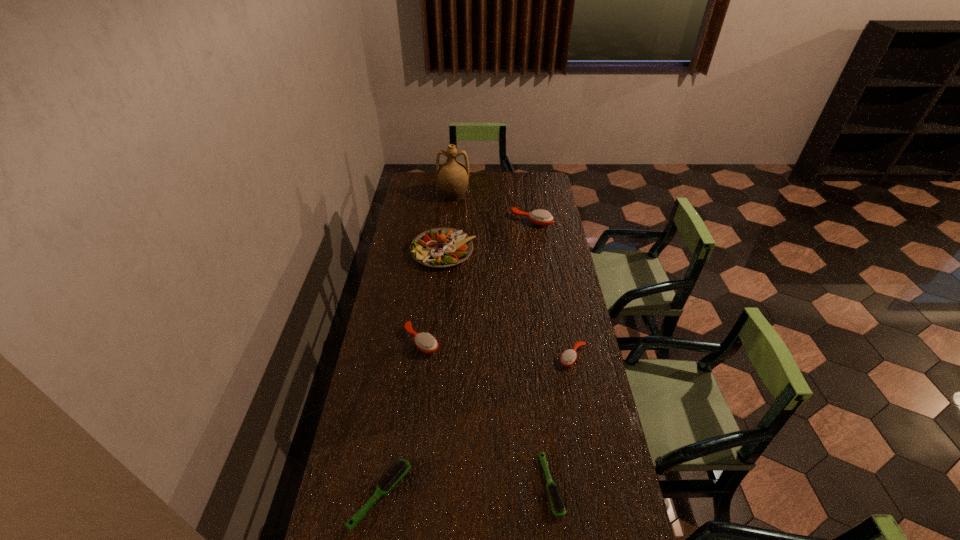
I want to click on the right light hairbrush, so click(x=557, y=504).

At what (x,y) coordinates should I click in order to perform the action: click on the shortest hairbrush. Please return your answer as a coordinate pair (x, y). This screenshot has width=960, height=540. Looking at the image, I should click on (557, 504).

Locate an element on the screen. The height and width of the screenshot is (540, 960). vacant space located on the front of the tallest object is located at coordinates [x=450, y=233].

Where is `vacant region located 0.180m on the front of the third farthest object`? vacant region located 0.180m on the front of the third farthest object is located at coordinates (439, 300).

Where is `free location located on the front of the farthest hairbrush`? free location located on the front of the farthest hairbrush is located at coordinates (540, 277).

Image resolution: width=960 pixels, height=540 pixels. In order to click on vacant region located on the front of the fourth tallest object in this screenshot , I will do `click(407, 458)`.

This screenshot has height=540, width=960. What are the coordinates of `free space located on the right of the left light hairbrush` in the screenshot? It's located at (512, 495).

Locate an element on the screen. This screenshot has width=960, height=540. free region located on the left of the smallest orange hairbrush is located at coordinates (531, 357).

You are a GUI agent. You are given a task and a screenshot of the screen. Output one action in this format:
    pyautogui.click(x=<x>, y=<y>)
    Task: Click on the vacant region located on the back of the right light hairbrush
    
    Given the screenshot: What is the action you would take?
    pyautogui.click(x=540, y=395)

Where is `object present at the far edge`? Image resolution: width=960 pixels, height=540 pixels. object present at the far edge is located at coordinates (453, 176).